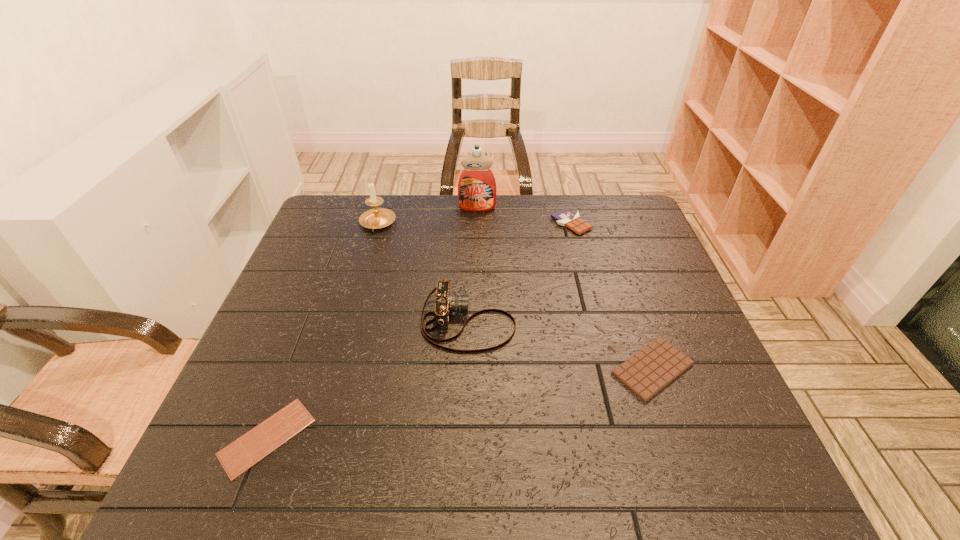
Locate an element on the screen. free area in between the second tallest chocolate bar and the tallest chocolate bar is located at coordinates (612, 296).

Find the location of a particular element. The height and width of the screenshot is (540, 960). free space that is in between the leftmost chocolate bar and the third tallest object is located at coordinates (368, 380).

Find the location of a particular element. This screenshot has width=960, height=540. vacant space that is in between the fourth tallest object and the fourth shortest object is located at coordinates pyautogui.click(x=519, y=273).

You are a GUI agent. You are given a task and a screenshot of the screen. Output one action in this format:
    pyautogui.click(x=<x>, y=<y>)
    Task: Click on the empty location between the camera and the fifth tallest object
    Image resolution: width=960 pixels, height=540 pixels.
    Given the screenshot: What is the action you would take?
    pyautogui.click(x=561, y=346)

Where is `free space between the tallest object and the second tallest object`? The height and width of the screenshot is (540, 960). free space between the tallest object and the second tallest object is located at coordinates (427, 215).

Where is `free space between the fifth tallest object and the third tallest object`? The width and height of the screenshot is (960, 540). free space between the fifth tallest object and the third tallest object is located at coordinates (561, 346).

I want to click on vacant space that is in between the tallest chocolate bar and the shortest chocolate bar, so click(x=420, y=330).

Find the location of a particular element. The width and height of the screenshot is (960, 540). empty space between the shortest object and the second shortest chocolate bar is located at coordinates (460, 403).

I want to click on vacant area that lies between the leftmost chocolate bar and the tallest chocolate bar, so tap(420, 330).

Identify the location of vacant space that is in between the candle holder and the detergent. The width and height of the screenshot is (960, 540). (427, 215).